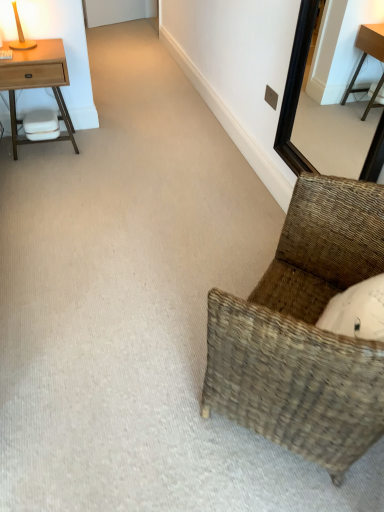
Question: Is black wooden mirror at upper right taller or shorter than matte wooden table lamp at upper left?

Choices:
 (A) tall
 (B) short

Answer: (A)

Question: Which is correct: black wooden mirror at upper right is inside matte wooden table lamp at upper left, or outside of it?

Choices:
 (A) outside
 (B) inside

Answer: (A)

Question: Considering the real-world distances, which object is farthest from the matte wooden table lamp at upper left?

Choices:
 (A) woven brown chair at lower right
 (B) black wooden mirror at upper right
 (C) light wood nightstand at left

Answer: (A)

Question: Estimate the real-world distances between objects in this image. Which object is farther from the black wooden mirror at upper right?

Choices:
 (A) woven brown chair at lower right
 (B) light wood nightstand at left
 (C) matte wooden table lamp at upper left

Answer: (C)